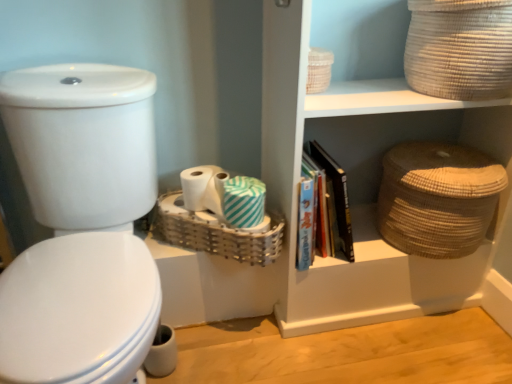
Question: Considering the relative sizes of white glossy toilet at left and hardcover book at center in the image provided, is white glossy toilet at left wider than hardcover book at center?

Choices:
 (A) no
 (B) yes

Answer: (B)

Question: From the image's perspective, is white glossy toilet at left over hardcover book at center?

Choices:
 (A) no
 (B) yes

Answer: (A)

Question: Is the position of white glossy toilet at left less distant than that of hardcover book at center?

Choices:
 (A) yes
 (B) no

Answer: (A)

Question: From the image's perspective, is white glossy toilet at left beneath hardcover book at center?

Choices:
 (A) yes
 (B) no

Answer: (A)

Question: Is white glossy toilet at left thinner than hardcover book at center?

Choices:
 (A) yes
 (B) no

Answer: (B)

Question: Can you confirm if white glossy toilet at left is positioned to the right of hardcover book at center?

Choices:
 (A) yes
 (B) no

Answer: (B)

Question: Does white striped toilet paper at center, which is the second toilet paper in right-to-left order, have a greater width compared to natural woven basket at upper right?

Choices:
 (A) yes
 (B) no

Answer: (B)

Question: Considering the relative positions of white striped toilet paper at center, which is the second toilet paper in right-to-left order, and natural woven basket at upper right in the image provided, is white striped toilet paper at center, which is the second toilet paper in right-to-left order, to the right of natural woven basket at upper right from the viewer's perspective?

Choices:
 (A) yes
 (B) no

Answer: (B)

Question: Is white striped toilet paper at center, which is the second toilet paper in right-to-left order, located outside natural woven basket at upper right?

Choices:
 (A) yes
 (B) no

Answer: (A)

Question: Is white striped toilet paper at center, which is the second toilet paper in right-to-left order, facing away from natural woven basket at upper right?

Choices:
 (A) yes
 (B) no

Answer: (B)

Question: Can you confirm if white striped toilet paper at center, which appears as the first toilet paper when viewed from the left, is shorter than natural woven basket at upper right?

Choices:
 (A) yes
 (B) no

Answer: (A)

Question: Is white striped toilet paper at center, which appears as the first toilet paper when viewed from the left, closer to camera compared to natural woven basket at upper right?

Choices:
 (A) yes
 (B) no

Answer: (B)

Question: Considering the relative positions of natural woven basket at upper right and white striped toilet paper at center, which is the second toilet paper in right-to-left order, in the image provided, is natural woven basket at upper right behind white striped toilet paper at center, which is the second toilet paper in right-to-left order,?

Choices:
 (A) yes
 (B) no

Answer: (B)